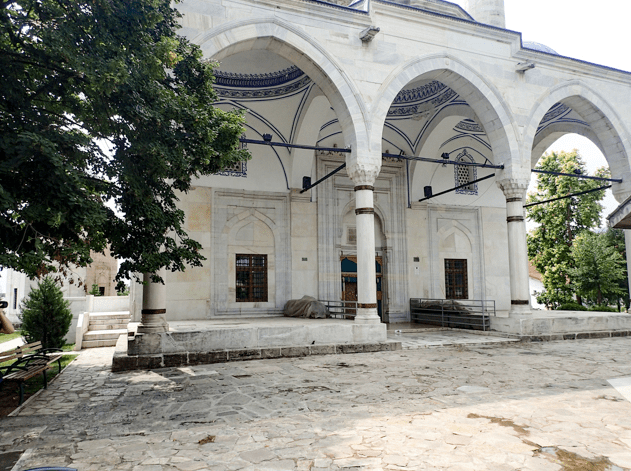
Locate an element on the screen. bench is located at coordinates (24, 371), (50, 358).